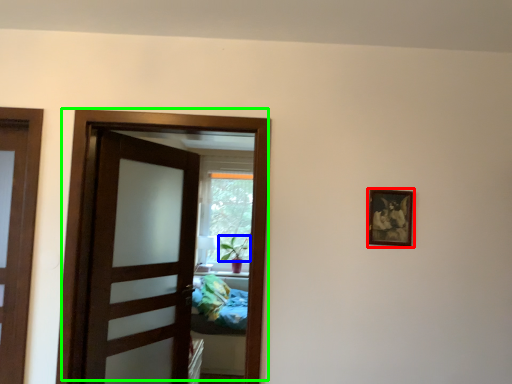
Question: Considering the real-world distances, which object is farthest from picture frame (highlighted by a red box)? plant (highlighted by a blue box) or door (highlighted by a green box)?

Choices:
 (A) plant
 (B) door

Answer: (A)